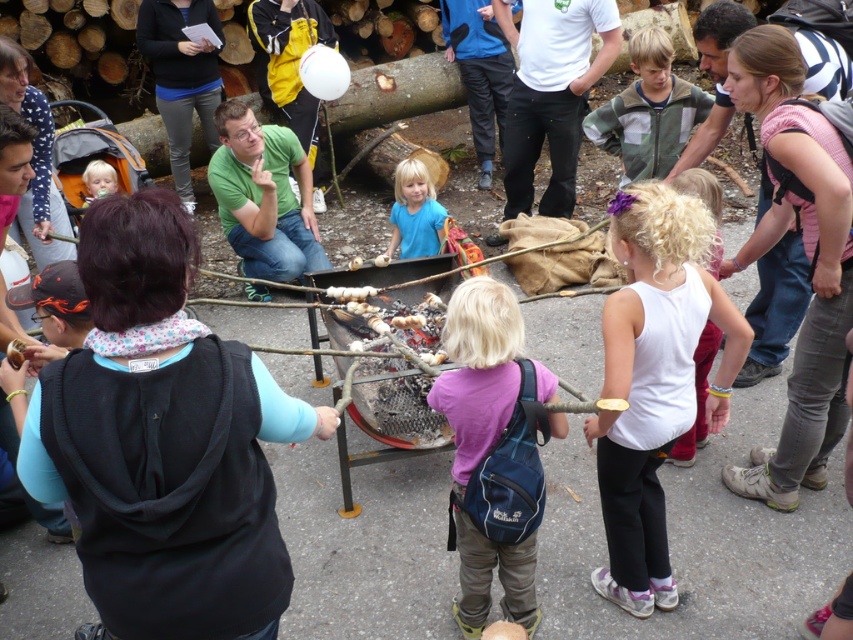
Question: Which is nearer to the light blue fabric at center?

Choices:
 (A) white cotton tank top at center
 (B) purple fabric backpack at center

Answer: (B)

Question: Is blue matte shirt at center further to the viewer compared to light blue fabric at center?

Choices:
 (A) no
 (B) yes

Answer: (A)

Question: In this image, where is purple fabric backpack at center located relative to green fleece jacket at center?

Choices:
 (A) below
 (B) above

Answer: (A)

Question: Which object appears closest to the camera in this image?

Choices:
 (A) purple fabric backpack at center
 (B) green fleece jacket at center

Answer: (A)

Question: Does white cotton tank top at center appear on the left side of light blue fabric at center?

Choices:
 (A) yes
 (B) no

Answer: (B)

Question: Which of the following is the closest to the observer?

Choices:
 (A) blue matte shirt at center
 (B) white cotton tank top at center

Answer: (B)